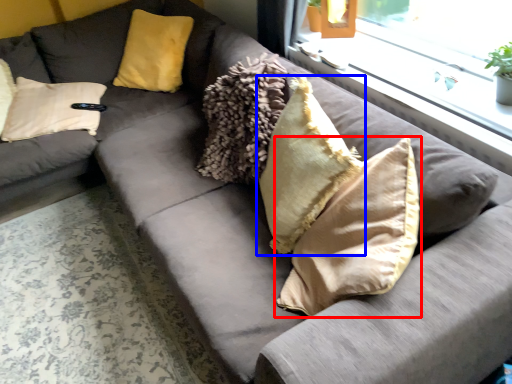
Question: Among these objects, which one is farthest to the camera, pillow (highlighted by a red box) or pillow (highlighted by a blue box)?

Choices:
 (A) pillow
 (B) pillow

Answer: (B)